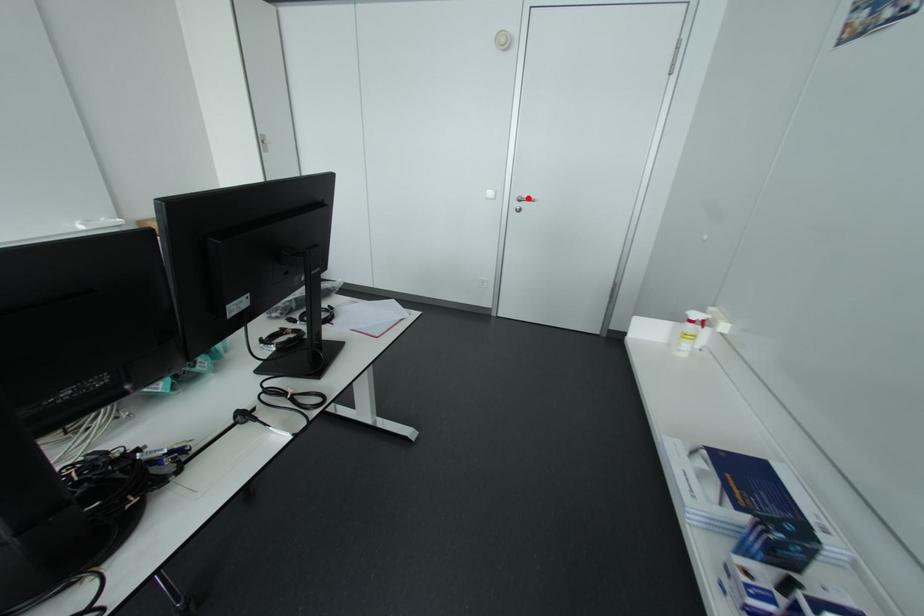
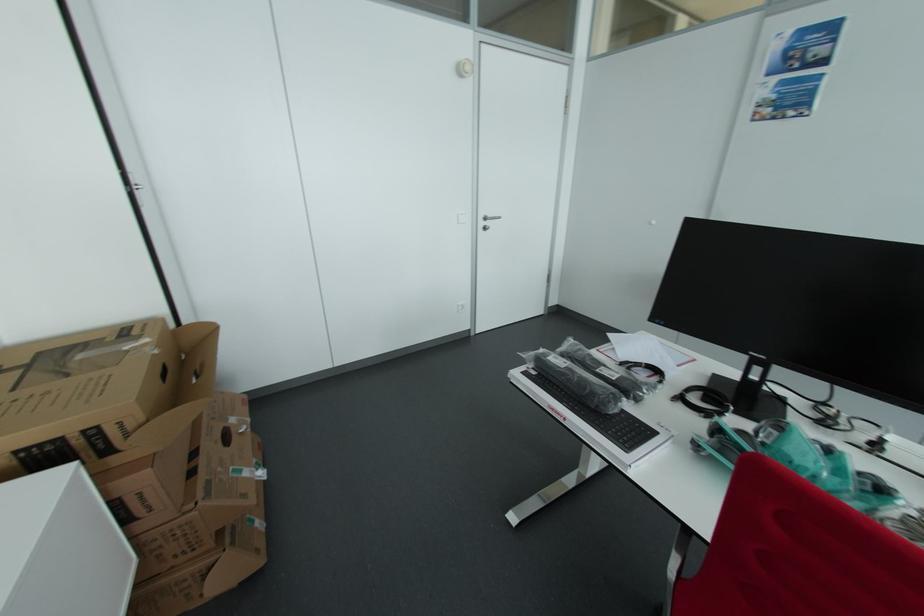
Locate, in the second image, the point that corresponds to the highlighted location in the first image.

(493, 216)